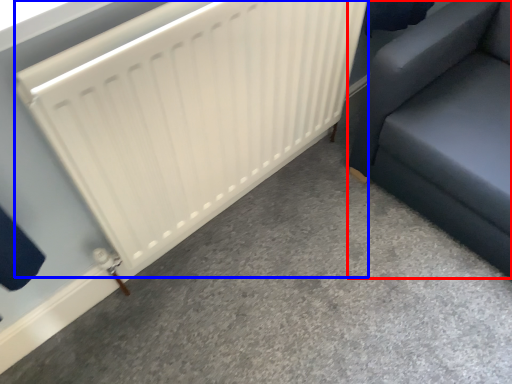
Question: Which point is closer to the camera, furniture (highlighted by a red box) or radiator (highlighted by a blue box)?

Choices:
 (A) furniture
 (B) radiator

Answer: (B)